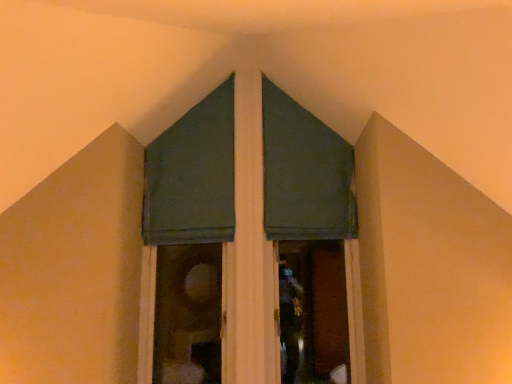
Question: Does green fabric curtain at center, placed as the second curtain when sorted from right to left, have a smaller size compared to green fabric curtain at upper center, the 3th curtain in the right-to-left sequence?

Choices:
 (A) no
 (B) yes

Answer: (A)

Question: Considering the relative positions of green fabric curtain at center, which ranks as the 2th curtain in left-to-right order, and green fabric curtain at upper center, marked as the 1th curtain in a left-to-right arrangement, in the image provided, is green fabric curtain at center, which ranks as the 2th curtain in left-to-right order, to the left of green fabric curtain at upper center, marked as the 1th curtain in a left-to-right arrangement, from the viewer's perspective?

Choices:
 (A) yes
 (B) no

Answer: (B)

Question: From the image's perspective, is green fabric curtain at center, which ranks as the 2th curtain in left-to-right order, on top of green fabric curtain at upper center, marked as the 1th curtain in a left-to-right arrangement?

Choices:
 (A) yes
 (B) no

Answer: (B)

Question: Is green fabric curtain at upper center, the 3th curtain in the right-to-left sequence, at the back of green fabric curtain at center, which ranks as the 2th curtain in left-to-right order?

Choices:
 (A) yes
 (B) no

Answer: (A)

Question: Is green fabric curtain at center, placed as the second curtain when sorted from right to left, wider than green fabric curtain at upper center, marked as the 1th curtain in a left-to-right arrangement?

Choices:
 (A) yes
 (B) no

Answer: (A)

Question: From a real-world perspective, is green fabric curtain at center, which ranks as the 2th curtain in left-to-right order, over green fabric curtain at upper center, the 3th curtain in the right-to-left sequence?

Choices:
 (A) no
 (B) yes

Answer: (A)

Question: Is dark green fabric at upper center, the third curtain viewed from the left, thinner than green fabric curtain at center, which ranks as the 2th curtain in left-to-right order?

Choices:
 (A) no
 (B) yes

Answer: (B)

Question: Does dark green fabric at upper center, which is counted as the 1th curtain, starting from the right, come in front of green fabric curtain at center, which ranks as the 2th curtain in left-to-right order?

Choices:
 (A) no
 (B) yes

Answer: (A)

Question: Considering the relative sizes of dark green fabric at upper center, which is counted as the 1th curtain, starting from the right, and green fabric curtain at center, placed as the second curtain when sorted from right to left, in the image provided, is dark green fabric at upper center, which is counted as the 1th curtain, starting from the right, bigger than green fabric curtain at center, placed as the second curtain when sorted from right to left,?

Choices:
 (A) no
 (B) yes

Answer: (A)

Question: Could you tell me if dark green fabric at upper center, the third curtain viewed from the left, is turned towards green fabric curtain at center, which ranks as the 2th curtain in left-to-right order?

Choices:
 (A) yes
 (B) no

Answer: (A)

Question: Does dark green fabric at upper center, the third curtain viewed from the left, have a lesser height compared to green fabric curtain at center, placed as the second curtain when sorted from right to left?

Choices:
 (A) no
 (B) yes

Answer: (B)

Question: From a real-world perspective, is dark green fabric at upper center, which is counted as the 1th curtain, starting from the right, under green fabric curtain at center, placed as the second curtain when sorted from right to left?

Choices:
 (A) no
 (B) yes

Answer: (A)

Question: Is dark green fabric at upper center, which is counted as the 1th curtain, starting from the right, further to camera compared to green fabric curtain at upper center, marked as the 1th curtain in a left-to-right arrangement?

Choices:
 (A) yes
 (B) no

Answer: (A)